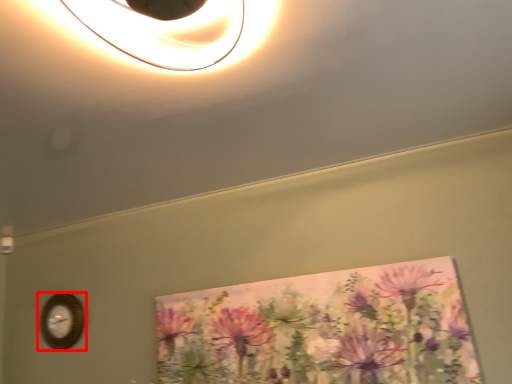
Question: In this image, where is wall clock (annotated by the red box) located relative to flower?

Choices:
 (A) right
 (B) left

Answer: (B)